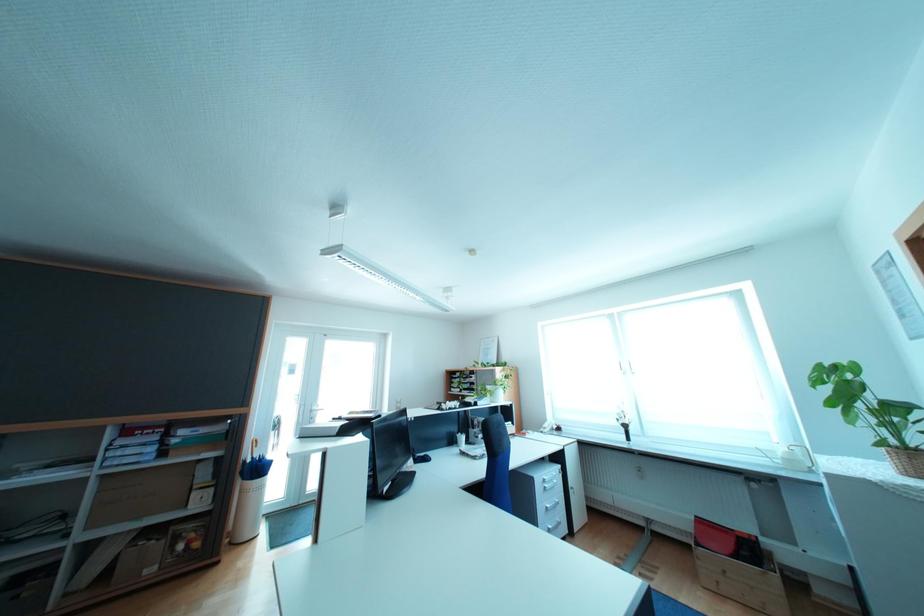
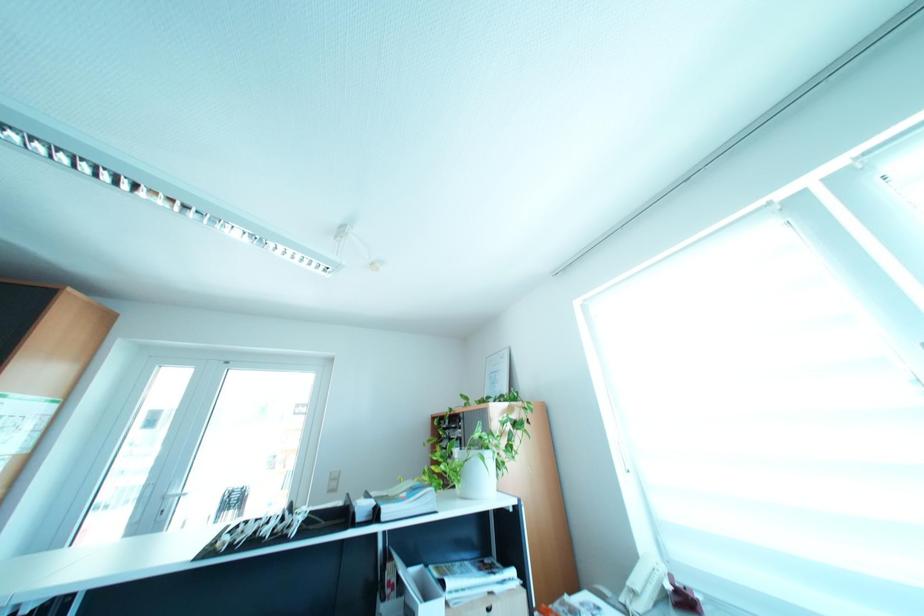
Which direction would the cameraman need to move to produce the second image?

The cameraman walked toward right, forward.